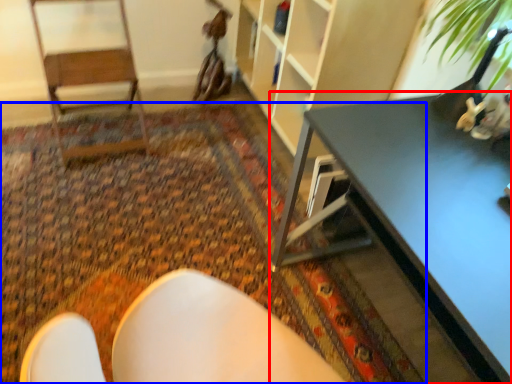
Question: Among these objects, which one is farthest to the camera, table (highlighted by a red box) or mat (highlighted by a blue box)?

Choices:
 (A) table
 (B) mat

Answer: (B)